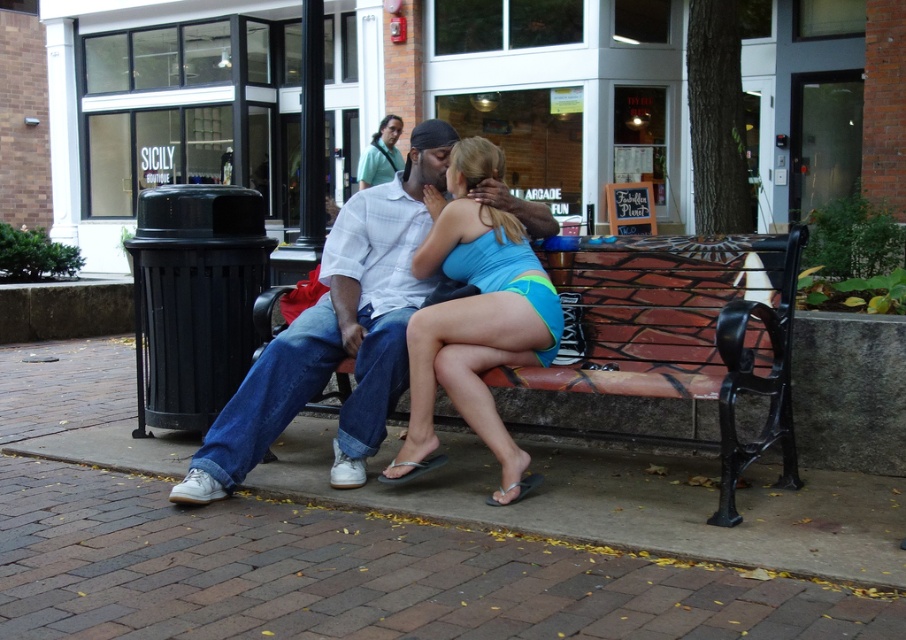
You are standing on the sidewalk in front of the SICILY BOUTIQUE. You see a point marked at coordinate (680, 336). What does this point represent?

The point at coordinate (680, 336) indicates the brick patterned bench at center.

You are standing at the point with coordinates point (232, 436) and want to walk to the point with coordinates point (511, 225). Which direction should you move?

You should move backward because point (232, 436) is in front of point (511, 225).